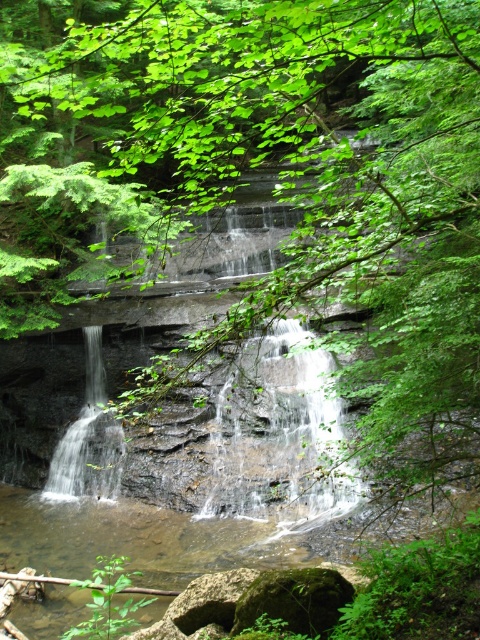
Question: Does smooth gray rock at center appear on the right side of translucent white water at left?

Choices:
 (A) no
 (B) yes

Answer: (B)

Question: Can you confirm if smooth gray rock at center is positioned to the left of translucent white water at left?

Choices:
 (A) yes
 (B) no

Answer: (B)

Question: Which point is farther to the camera?

Choices:
 (A) (95, 324)
 (B) (333, 477)

Answer: (A)

Question: Does smooth gray rock at center appear on the right side of translucent white water at left?

Choices:
 (A) no
 (B) yes

Answer: (B)

Question: Which object appears closest to the camera in this image?

Choices:
 (A) translucent white water at left
 (B) smooth gray rock at center

Answer: (B)